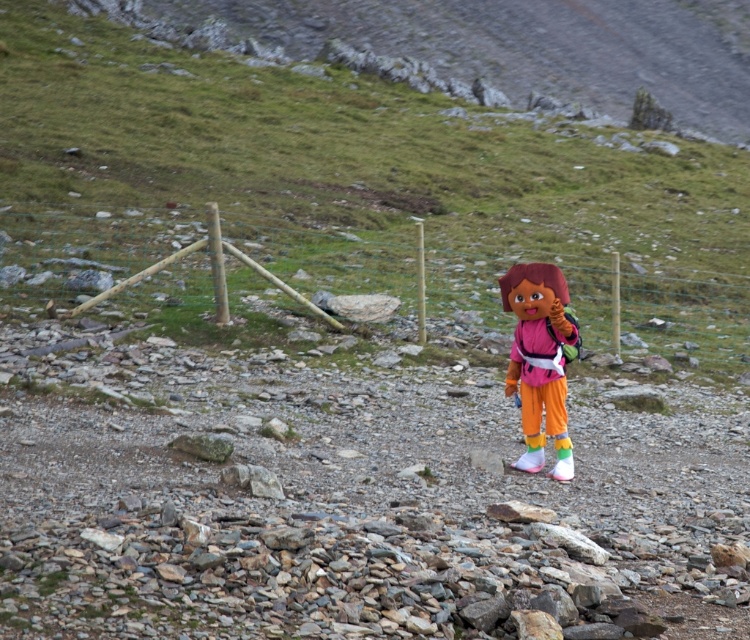
You are a photographer trying to capture the matte pink plush doll at center and the green grassy hillside at center in the same frame. Based on their positions, which object is closer to the camera?

The green grassy hillside at center is closer to the camera because the matte pink plush doll at center is positioned behind it.

You are standing at the bottom of the green grassy hillside at center. Which direction should you walk to reach the top?

The green grassy hillside at center is located at coordinates point (345, 150), so you should walk towards the center of the image to reach the top.

You are a photographer trying to capture a wide shot of the scene. You notice the green grassy hillside at center and the matte pink plush doll at center. Which object is wider in the image?

The green grassy hillside at center is wider than the matte pink plush doll at center according to the description provided.